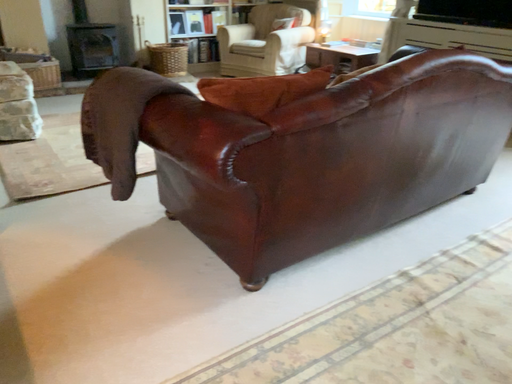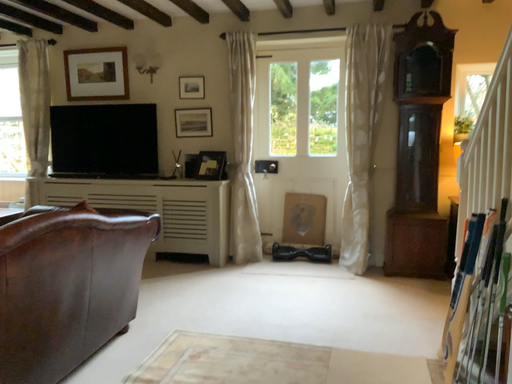
Question: Which way did the camera rotate in the video?

Choices:
 (A) rotated downward
 (B) rotated upward

Answer: (B)